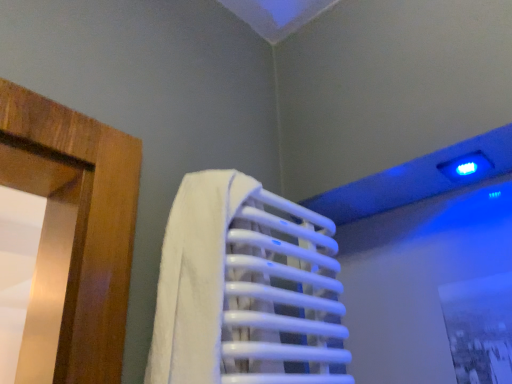
In the scene shown: What is the approximate width of white soft towel at center?

7.11 inches.

What is the approximate height of white soft towel at center?

It is 12.91 inches.

The height and width of the screenshot is (384, 512). What do you see at coordinates (245, 288) in the screenshot? I see `white soft towel at center` at bounding box center [245, 288].

The image size is (512, 384). In order to click on white soft towel at center in this screenshot , I will do `click(245, 288)`.

Find the location of `white soft towel at center`. white soft towel at center is located at coordinates (245, 288).